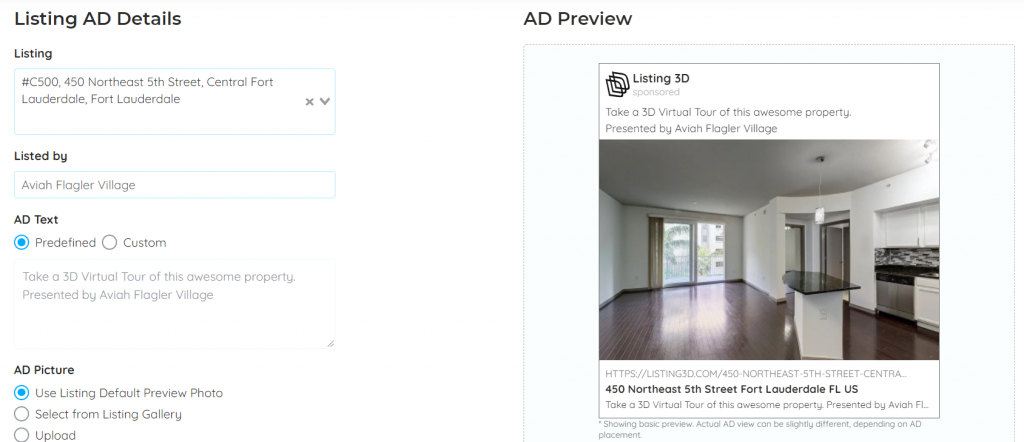
This screenshot has height=442, width=1024. Find the location of `hardwood floor`. hardwood floor is located at coordinates (680, 335).